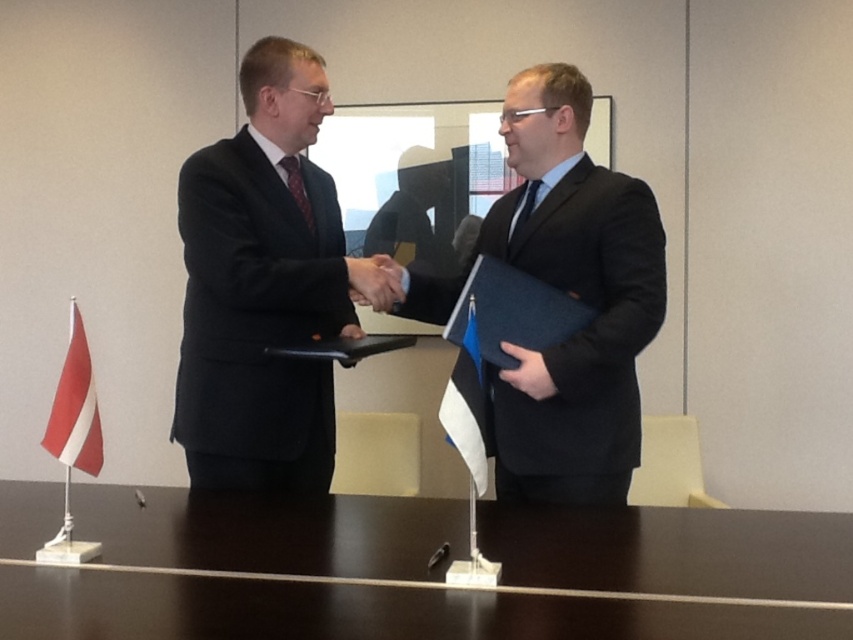
Does black matte suit at center appear under black fabric hand at center?

Incorrect, black matte suit at center is not positioned below black fabric hand at center.

Which is below, black matte suit at center or black fabric hand at center?

black fabric hand at center

This screenshot has height=640, width=853. In order to click on black matte suit at center in this screenshot , I will do `click(572, 296)`.

Is matte black suit at center to the left of black matte suit at center from the viewer's perspective?

Correct, you'll find matte black suit at center to the left of black matte suit at center.

Can you confirm if matte black suit at center is thinner than black matte suit at center?

Yes, matte black suit at center is thinner than black matte suit at center.

Which is in front, point (291, 113) or point (645, 289)?

Point (645, 289)

You are a GUI agent. You are given a task and a screenshot of the screen. Output one action in this format:
    pyautogui.click(x=<x>, y=<y>)
    Task: Click on the matte black suit at center
    This screenshot has width=853, height=640.
    Given the screenshot: What is the action you would take?
    pyautogui.click(x=265, y=285)

Is dark wood table at center thinner than black matte suit at center?

In fact, dark wood table at center might be wider than black matte suit at center.

Is dark wood table at center smaller than black matte suit at center?

Yes, dark wood table at center is smaller than black matte suit at center.

Is point (428, 506) closer to camera compared to point (606, 365)?

No, it is behind (606, 365).

Locate an element on the screen. dark wood table at center is located at coordinates (440, 572).